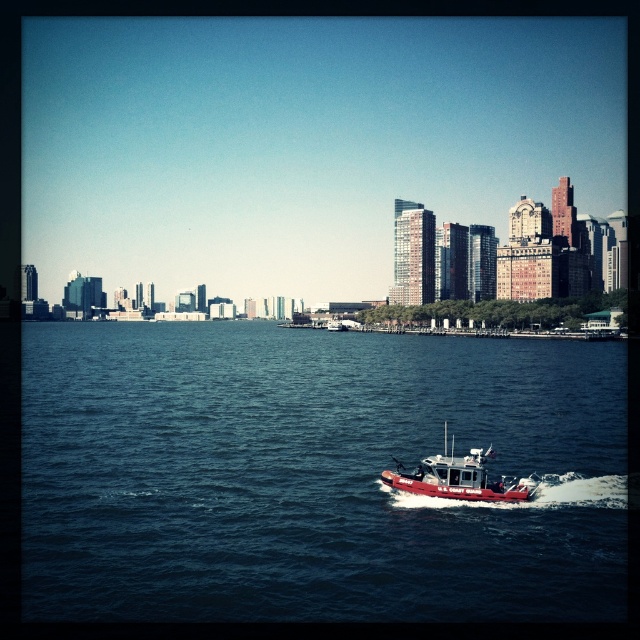
Is blue water at center below red matte boat at center?

Incorrect, blue water at center is not positioned below red matte boat at center.

Measure the distance between point (369,440) and camera.

The distance of point (369,440) from camera is 80.15 meters.

Locate an element on the screen. blue water at center is located at coordinates (314, 476).